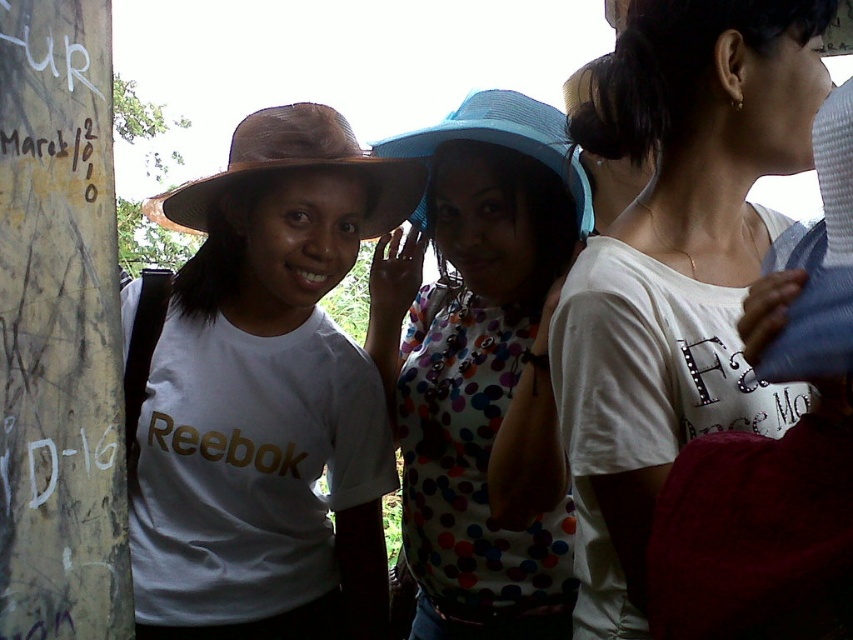
You are a photographer trying to capture the polka dot fabric shirt at center. You have a camera with a zoom lens that can focus on a specific point. The point you selected is at coordinates point (482, 368). Can you confirm if this point is on the polka dot fabric shirt at center?

Yes, the point (482, 368) is on the polka dot fabric shirt at center as stated in the description.

You are standing in the scene and want to move closer to the weathered concrete pillar at left. However, there is a matte brown hat at left in your path. Can you walk directly to the pillar without moving the hat?

The weathered concrete pillar at left is behind matte brown hat at left, so you can walk directly to the pillar without moving the hat because it is positioned behind the hat.

You are a photographer trying to capture a photo of the matte brown hat at left and the weathered concrete pillar at left. Based on their positions, which object should you focus on first to ensure both are in frame?

The matte brown hat at left might be wider than weathered concrete pillar at left, so you should focus on the matte brown hat at left first to ensure both are in frame.